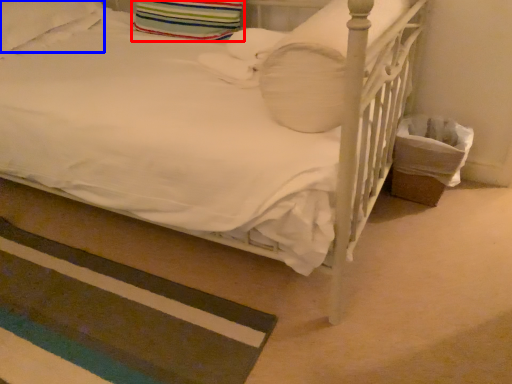
Question: Which object appears farthest to the camera in this image, pillow (highlighted by a red box) or pillow (highlighted by a blue box)?

Choices:
 (A) pillow
 (B) pillow

Answer: (A)